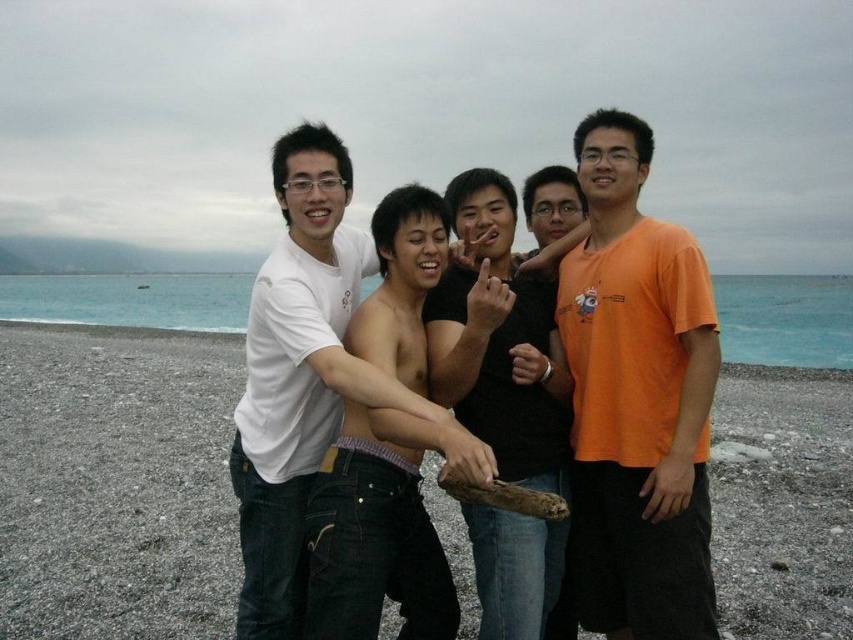
You are a photographer trying to capture a candid shot of the two men in the center of the image wearing the shiny black shirt at center and the white cotton shirt at center. Which one is positioned lower in the frame?

The shiny black shirt at center is positioned below the white cotton shirt at center, so the man wearing the shiny black shirt at center is lower in the frame.

You are standing at the point with coordinates point (798, 525) and want to walk to point (248, 598). Which direction should you move in to get closer to your destination?

You should move downward and to the right because point (248, 598) is located lower and further to the right compared to point (798, 525).